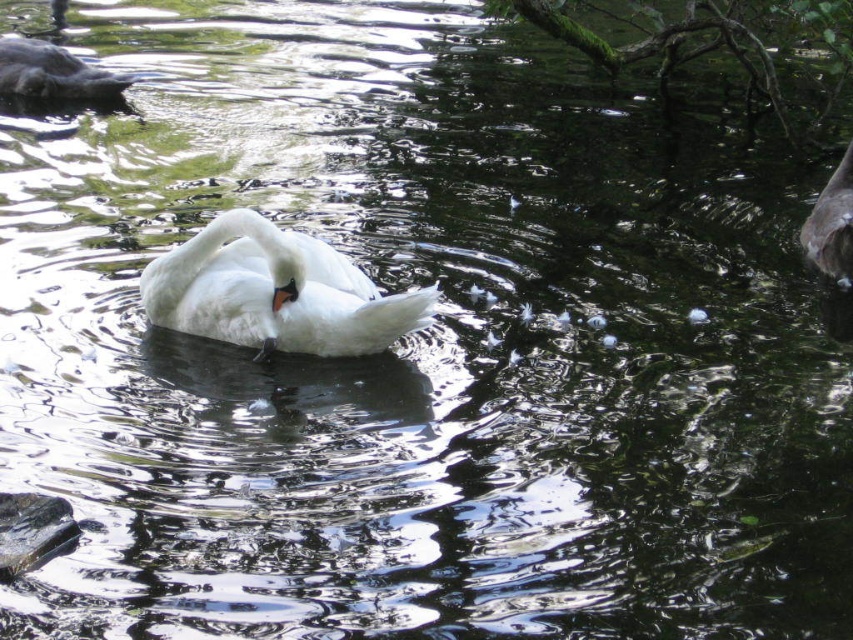
Between white feathered swan at center and dark gray feathers at upper right, which one appears on the left side from the viewer's perspective?

white feathered swan at center

Does white feathered swan at center have a greater height compared to dark gray feathers at upper right?

No.

In the scene shown: Who is more forward, [254,339] or [850,193]?

Positioned in front is point [254,339].

Identify the location of white feathered swan at center. The width and height of the screenshot is (853, 640). (274, 291).

Does white feathered swan at center appear under dark gray duck at upper left?

Correct, white feathered swan at center is located below dark gray duck at upper left.

Locate an element on the screen. white feathered swan at center is located at coordinates (274, 291).

You are a GUI agent. You are given a task and a screenshot of the screen. Output one action in this format:
    pyautogui.click(x=<x>, y=<y>)
    Task: Click on the white feathered swan at center
    
    Given the screenshot: What is the action you would take?
    pyautogui.click(x=274, y=291)

How far apart are dark gray duck at upper left and dark gray feathers at upper right?

The distance of dark gray duck at upper left from dark gray feathers at upper right is 15.52 feet.

Can you confirm if dark gray duck at upper left is positioned above dark gray feathers at upper right?

Yes, dark gray duck at upper left is above dark gray feathers at upper right.

Is point (117, 81) positioned in front of point (819, 237)?

No, it is not.

This screenshot has width=853, height=640. Find the location of `dark gray duck at upper left`. dark gray duck at upper left is located at coordinates (51, 74).